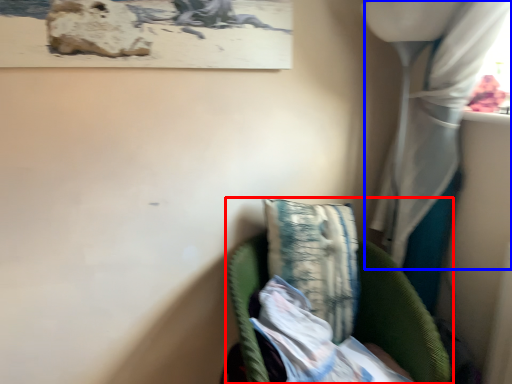
Question: Which object appears closest to the camera in this image, furniture (highlighted by a red box) or curtain (highlighted by a blue box)?

Choices:
 (A) furniture
 (B) curtain

Answer: (B)